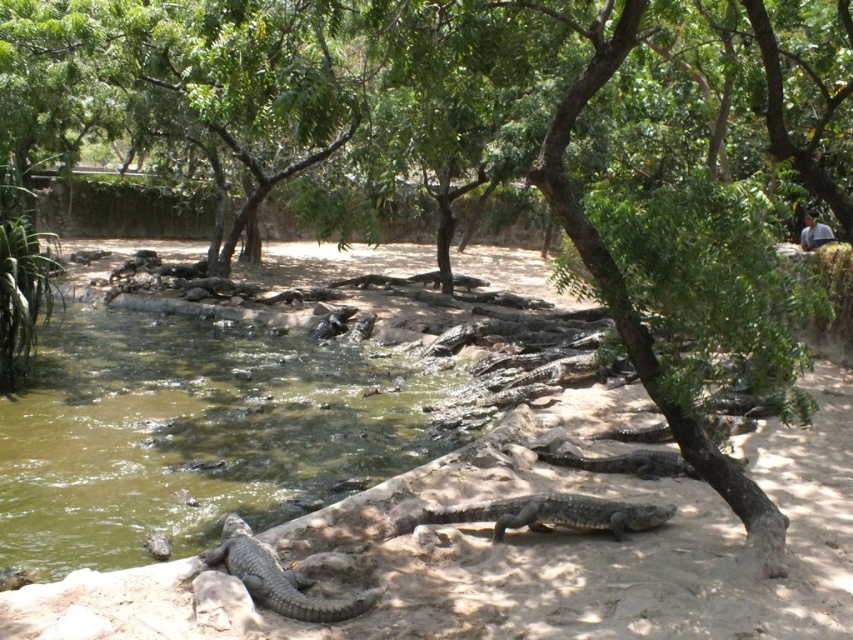
You are a wildlife photographer aiming to capture a clear image of the gray scaly crocodile at lower left. You notice that the greenish murky water at center might obstruct your view. Can you estimate whether the crocodile is wider than the water body to position your camera accordingly?

The greenish murky water at center is wider than the gray scaly crocodile at lower left, so the crocodile is not wider than the water body. Position your camera to account for the water width.

You are a wildlife researcher observing crocodiles in their habitat. You notice the dark gray textured crocodile at center and the gray scaly crocodile at lower left. Which crocodile is shorter in height?

The dark gray textured crocodile at center has a lesser height compared to the gray scaly crocodile at lower left, so the dark gray textured crocodile at center is shorter in height.